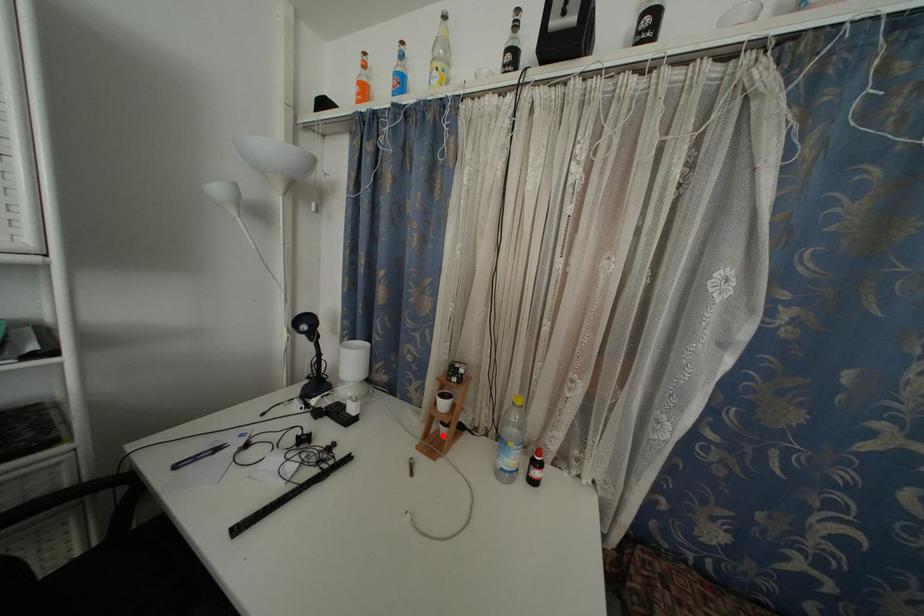
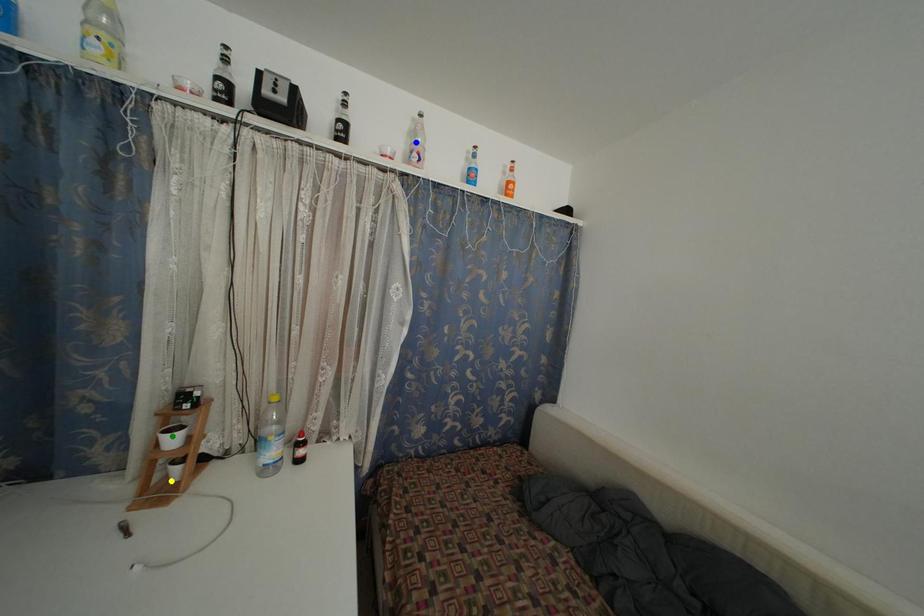
Question: I am providing you with two images of the same scene from different viewpoints. A red point is marked on the first image. You are given multiple points on the second image. Which point in image 2 is actually the same real-world point as the red point in image 1?

Choices:
 (A) green point
 (B) blue point
 (C) yellow point

Answer: (C)